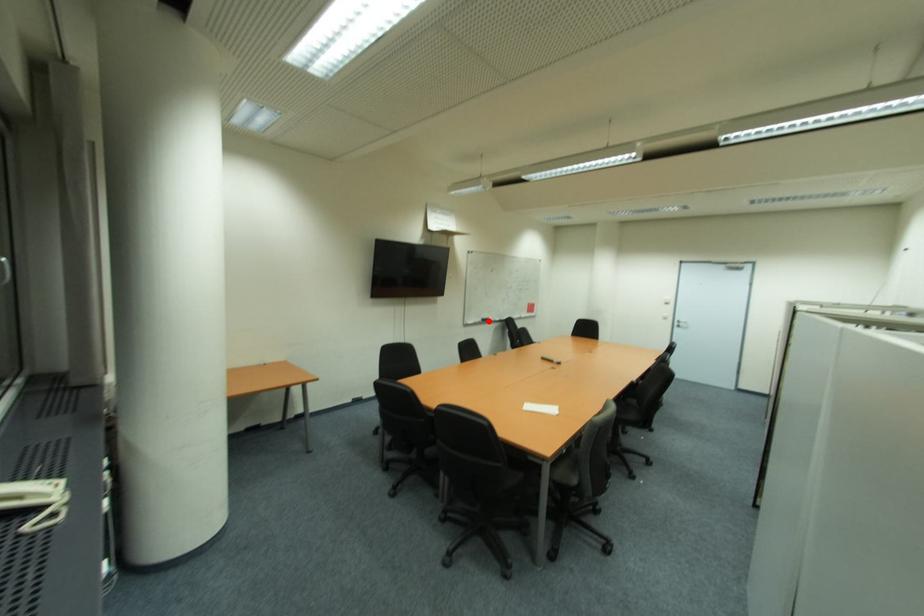
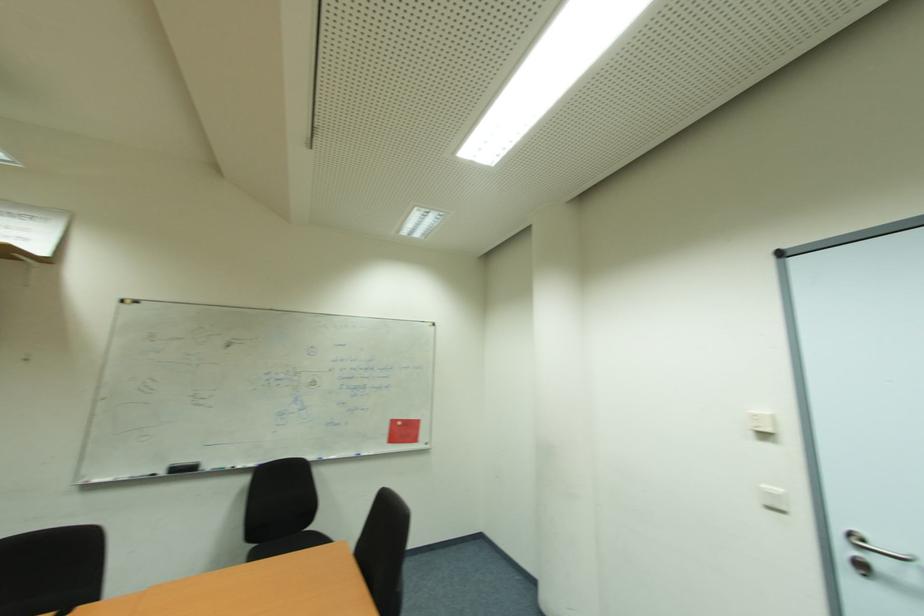
Question: I am providing you with two images of the same scene from different viewpoints. A red point is marked on the first image. Can you still see the location of the red point in image 2?

Choices:
 (A) Yes
 (B) No

Answer: (A)